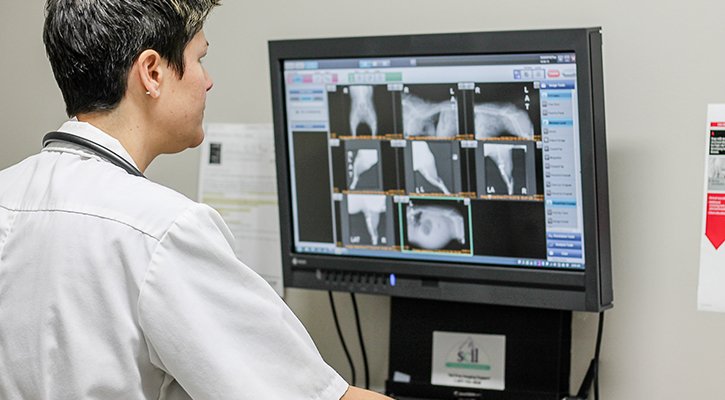
I want to click on off white wall, so click(x=647, y=119), click(x=222, y=49), click(x=169, y=171), click(x=32, y=76).